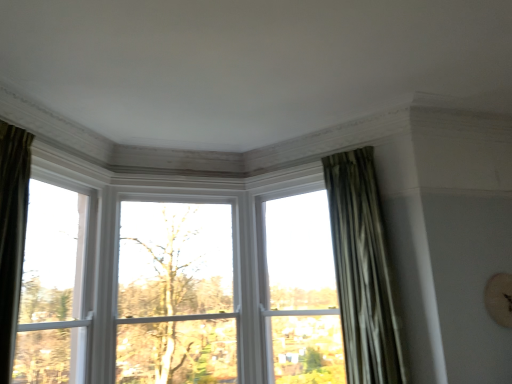
Question: Considering the positions of green leafy tree at center and silky green curtain at right in the image, is green leafy tree at center wider or thinner than silky green curtain at right?

Choices:
 (A) thin
 (B) wide

Answer: (A)

Question: Is point (204, 306) positioned closer to the camera than point (357, 235)?

Choices:
 (A) farther
 (B) closer

Answer: (A)

Question: Which of these objects is positioned closest to the green leafy tree at center?

Choices:
 (A) silky green curtain at right
 (B) white wood window at left, which is the 2th window from right to left
 (C) clear glass window at center, the 1th window positioned from the right

Answer: (B)

Question: Which of these objects is positioned farthest from the clear glass window at center, arranged as the second window when viewed from the left?

Choices:
 (A) white wood window at left, which ranks as the first window in left-to-right order
 (B) green leafy tree at center
 (C) silky green curtain at right

Answer: (A)